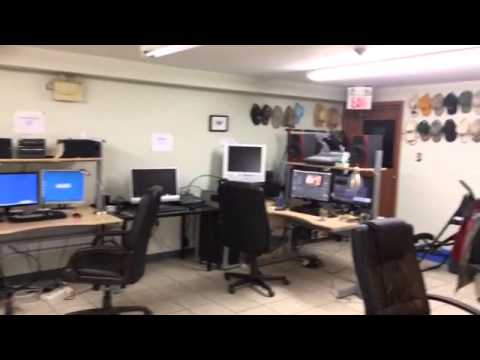
Locate an element on the screen. monitors is located at coordinates (307, 188), (243, 162), (162, 184), (66, 180), (26, 188).